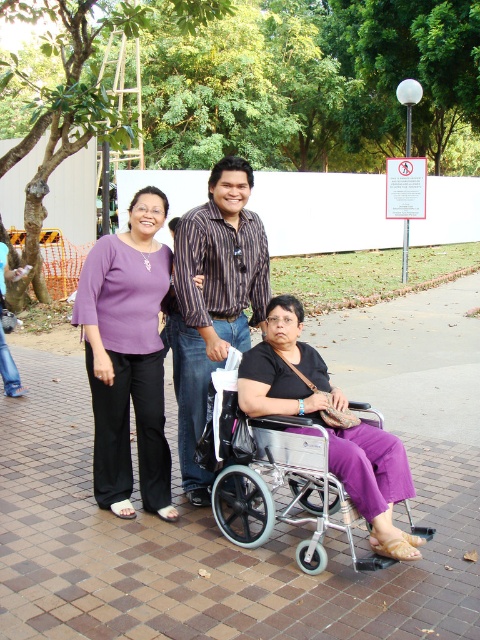
Based on the coordinates provided, which object is located at point (128, 356) in the image?

The point (128, 356) marks the purple matte pants at center.

You are a fashion designer observing the clothing in the scene. Which of the two shirts, the purple fabric shirt at upper left or the striped fabric shirt at center, has a larger size?

The purple fabric shirt at upper left is bigger than the striped fabric shirt at center.